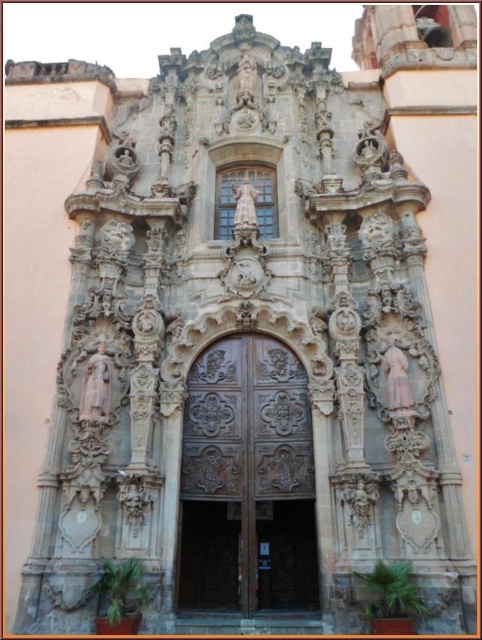
In the scene shown: Which is more to the left, brown carved wood door at center or pink marble statue at upper left?

Positioned to the left is pink marble statue at upper left.

Locate an element on the screen. brown carved wood door at center is located at coordinates (246, 481).

Can you confirm if pink marble statue at upper left is positioned to the right of white marble statue at center?

No, pink marble statue at upper left is not to the right of white marble statue at center.

How distant is pink marble statue at upper left from white marble statue at center?

The distance of pink marble statue at upper left from white marble statue at center is 22.88 meters.

Image resolution: width=482 pixels, height=640 pixels. What are the coordinates of `pink marble statue at upper left` in the screenshot? It's located at (98, 387).

Is brown carved wood door at center wider than white marble statue at center?

Indeed, brown carved wood door at center has a greater width compared to white marble statue at center.

You are a GUI agent. You are given a task and a screenshot of the screen. Output one action in this format:
    pyautogui.click(x=<x>, y=<y>)
    Task: Click on the brown carved wood door at center
    Image resolution: width=482 pixels, height=640 pixels.
    Given the screenshot: What is the action you would take?
    pyautogui.click(x=246, y=481)

I want to click on brown carved wood door at center, so click(x=246, y=481).